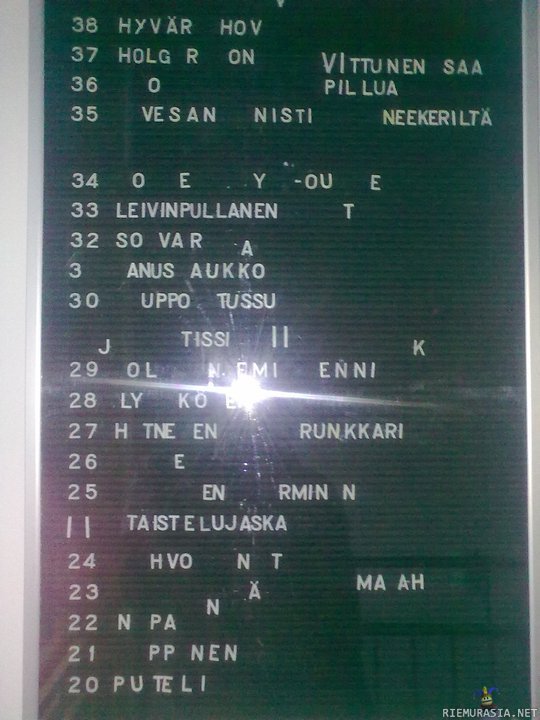
The width and height of the screenshot is (540, 720). I want to click on glass, so click(x=54, y=448).